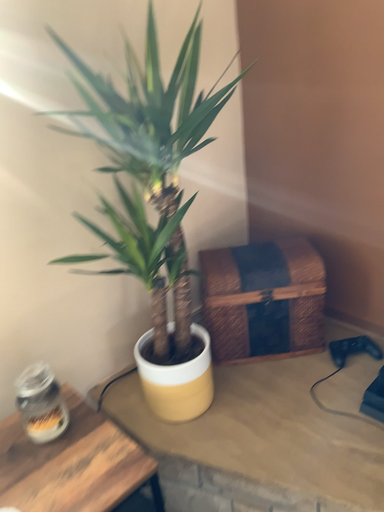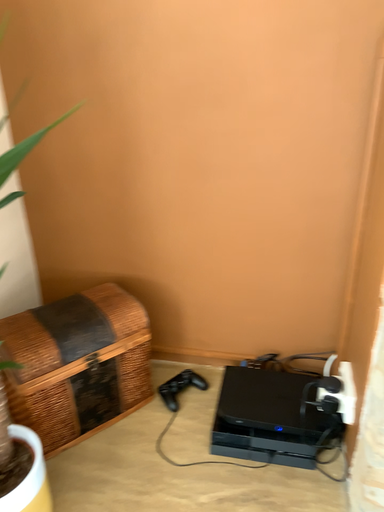
Question: How did the camera likely rotate when shooting the video?

Choices:
 (A) rotated downward
 (B) rotated upward

Answer: (B)